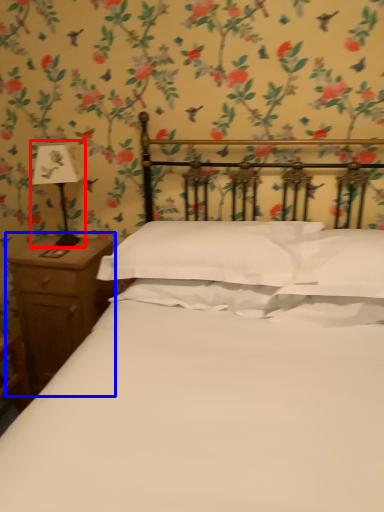
Question: Which object appears closest to the camera in this image, bedside lamp (highlighted by a red box) or nightstand (highlighted by a blue box)?

Choices:
 (A) bedside lamp
 (B) nightstand

Answer: (A)